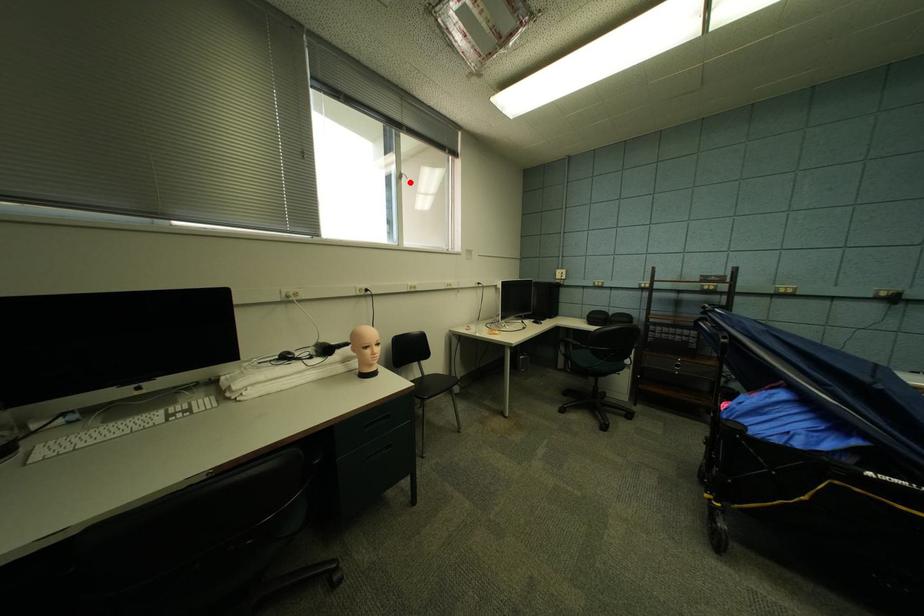
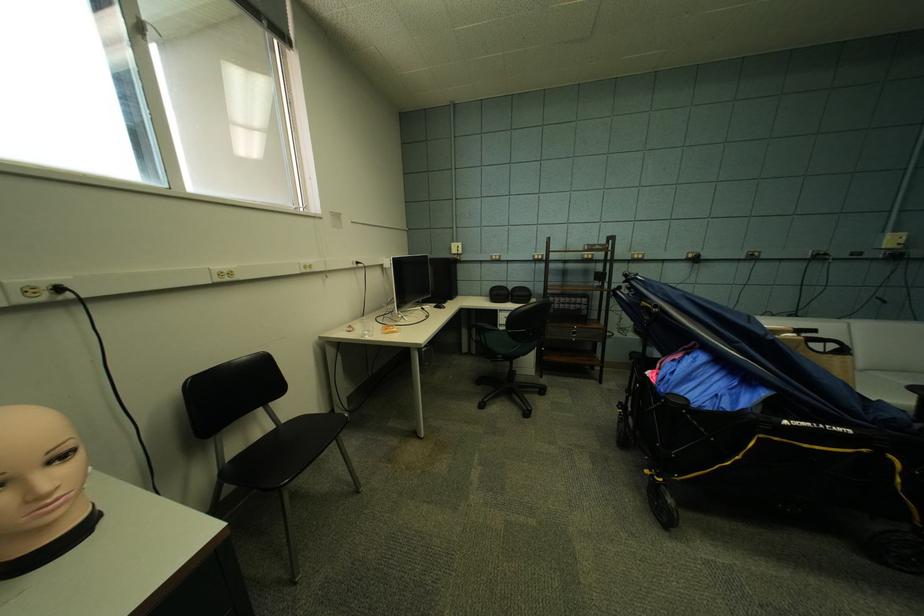
In the second image, find the point that corresponds to the highlighted location in the first image.

(154, 42)